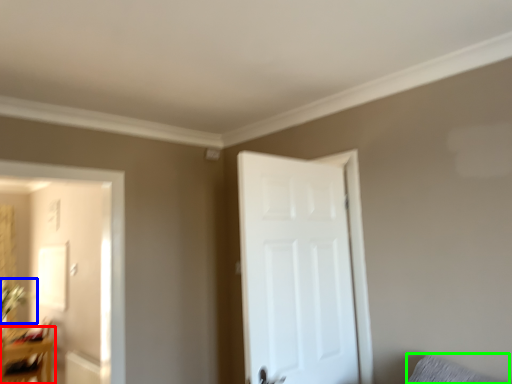
Question: Estimate the real-world distances between objects in this image. Which object is closer to table (highlighted by a red box), plant (highlighted by a blue box) or pillow (highlighted by a green box)?

Choices:
 (A) plant
 (B) pillow

Answer: (A)